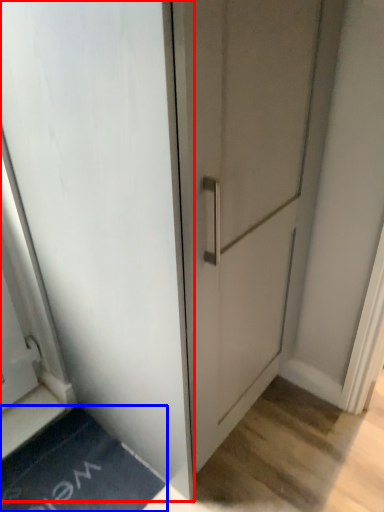
Question: Which point is further to the camera, door (highlighted by a red box) or bath mat (highlighted by a blue box)?

Choices:
 (A) door
 (B) bath mat

Answer: (B)